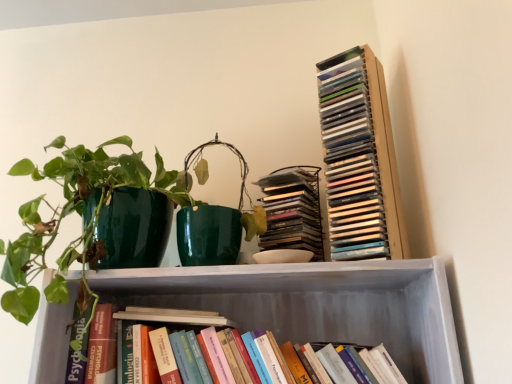
Question: Does hardcover books at lower center, the 1th book positioned from the bottom, touch matte plastic stack of cds at upper right, marked as the 2th book in a bottom-to-top arrangement?

Choices:
 (A) yes
 (B) no

Answer: (B)

Question: Can you confirm if hardcover books at lower center, the 1th book positioned from the bottom, is taller than matte plastic stack of cds at upper right, the second book positioned from the top?

Choices:
 (A) yes
 (B) no

Answer: (B)

Question: Is hardcover books at lower center, the 1th book positioned from the bottom, at the left side of matte plastic stack of cds at upper right, marked as the 2th book in a bottom-to-top arrangement?

Choices:
 (A) yes
 (B) no

Answer: (A)

Question: Is hardcover books at lower center, the 3th book when ordered from top to bottom, turned away from matte plastic stack of cds at upper right, the second book positioned from the top?

Choices:
 (A) no
 (B) yes

Answer: (A)

Question: Considering the relative sizes of hardcover books at lower center, the 1th book positioned from the bottom, and matte plastic stack of cds at upper right, marked as the 2th book in a bottom-to-top arrangement, in the image provided, is hardcover books at lower center, the 1th book positioned from the bottom, shorter than matte plastic stack of cds at upper right, marked as the 2th book in a bottom-to-top arrangement,?

Choices:
 (A) yes
 (B) no

Answer: (A)

Question: Does hardcover books at lower center, the 1th book positioned from the bottom, have a lesser width compared to matte plastic stack of cds at upper right, the second book positioned from the top?

Choices:
 (A) yes
 (B) no

Answer: (B)

Question: Is clear plastic stack of cds at upper right, positioned as the 3th book in bottom-to-top order, smaller than matte plastic stack of cds at upper right, marked as the 2th book in a bottom-to-top arrangement?

Choices:
 (A) no
 (B) yes

Answer: (A)

Question: Is clear plastic stack of cds at upper right, positioned as the 3th book in bottom-to-top order, located outside matte plastic stack of cds at upper right, the second book positioned from the top?

Choices:
 (A) no
 (B) yes

Answer: (B)

Question: Does clear plastic stack of cds at upper right, acting as the first book starting from the top, lie behind matte plastic stack of cds at upper right, marked as the 2th book in a bottom-to-top arrangement?

Choices:
 (A) no
 (B) yes

Answer: (A)

Question: Is clear plastic stack of cds at upper right, positioned as the 3th book in bottom-to-top order, taller than matte plastic stack of cds at upper right, marked as the 2th book in a bottom-to-top arrangement?

Choices:
 (A) no
 (B) yes

Answer: (B)

Question: Is clear plastic stack of cds at upper right, acting as the first book starting from the top, bigger than matte plastic stack of cds at upper right, the second book positioned from the top?

Choices:
 (A) no
 (B) yes

Answer: (B)

Question: From the image's perspective, would you say clear plastic stack of cds at upper right, positioned as the 3th book in bottom-to-top order, is shown under matte plastic stack of cds at upper right, marked as the 2th book in a bottom-to-top arrangement?

Choices:
 (A) yes
 (B) no

Answer: (B)

Question: Considering the relative sizes of matte plastic stack of cds at upper right, marked as the 2th book in a bottom-to-top arrangement, and clear plastic stack of cds at upper right, acting as the first book starting from the top, in the image provided, is matte plastic stack of cds at upper right, marked as the 2th book in a bottom-to-top arrangement, wider than clear plastic stack of cds at upper right, acting as the first book starting from the top,?

Choices:
 (A) yes
 (B) no

Answer: (A)